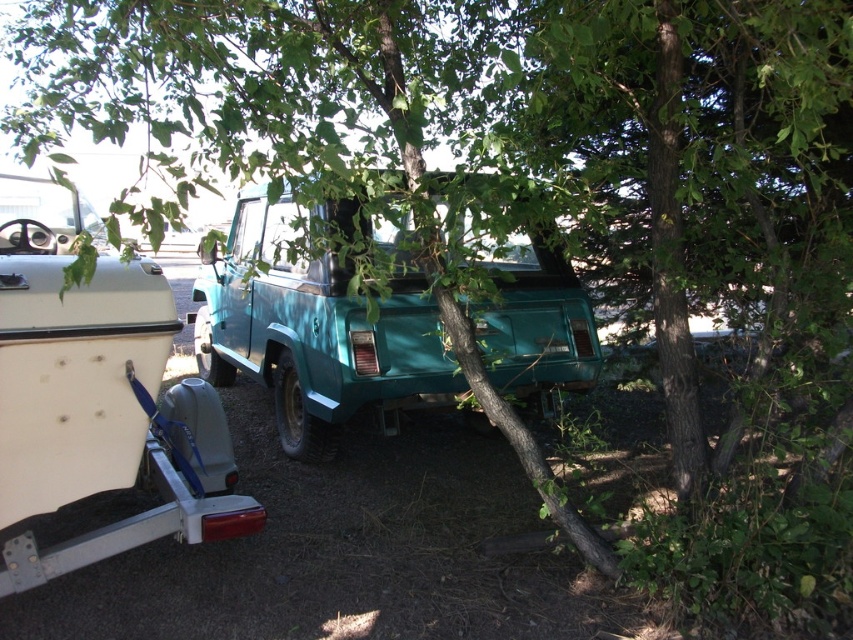
Can you confirm if teal matte pickup truck at left is positioned to the left of teal matte pickup truck at center?

Correct, you'll find teal matte pickup truck at left to the left of teal matte pickup truck at center.

Is teal matte pickup truck at left closer to camera compared to teal matte pickup truck at center?

Yes, teal matte pickup truck at left is in front of teal matte pickup truck at center.

Image resolution: width=853 pixels, height=640 pixels. What do you see at coordinates (96, 396) in the screenshot?
I see `teal matte pickup truck at left` at bounding box center [96, 396].

In order to click on teal matte pickup truck at left in this screenshot , I will do `click(96, 396)`.